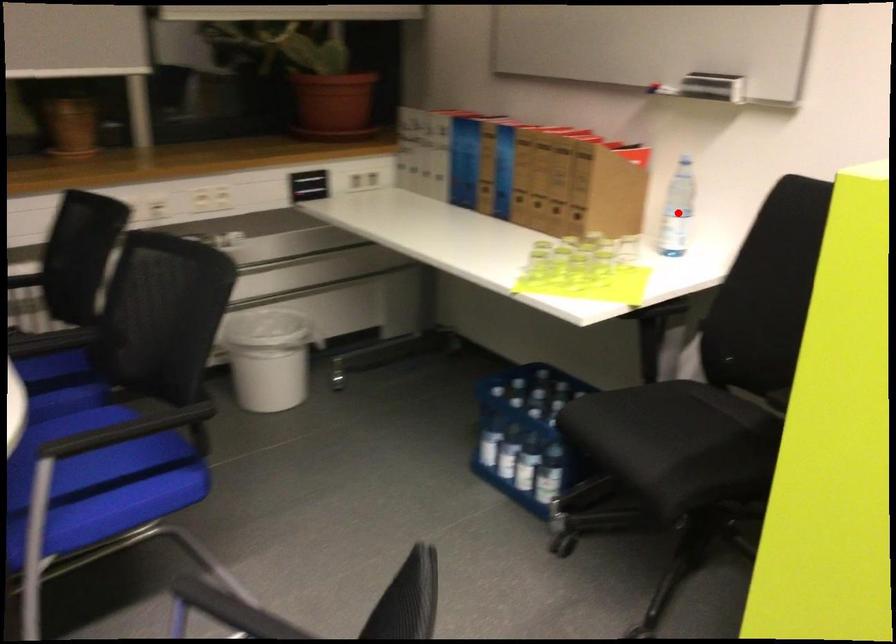
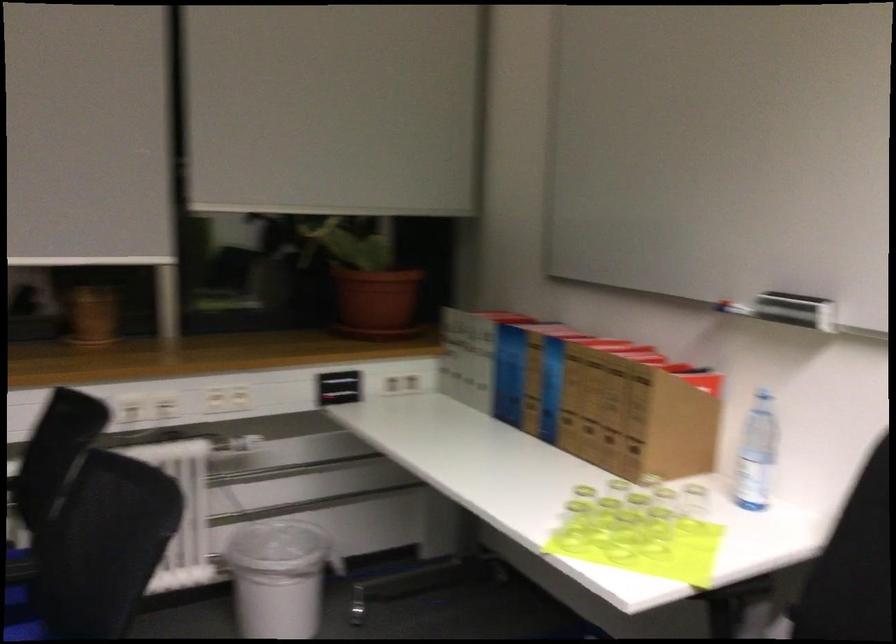
Question: I am providing you with two images of the same scene from different viewpoints. Image1 has a red point marked. In image2, the corresponding 3D location appears at what relative position? Reply with the corresponding letter.

Choices:
 (A) Closer
 (B) Farther

Answer: (A)